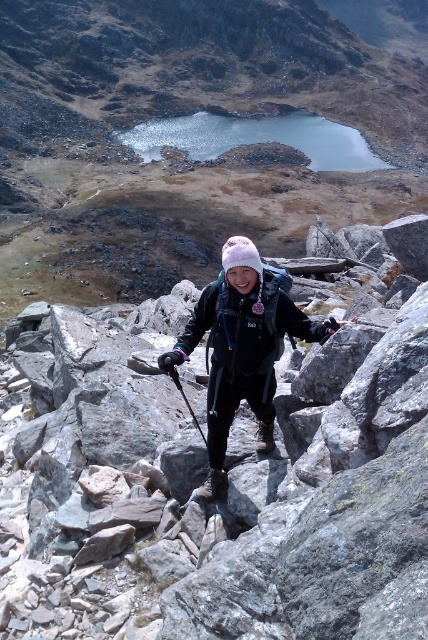
You are a hiker planning to place a small first aid kit on the ground near the matte black backpack at center. The first aid kit requires a flat surface. Based on the scene description, is the area around point (189, 148) suitable for placing the first aid kit?

The area around point (189, 148) has the matte black backpack at center. The scene describes the ground as uneven with small stones and patches of grass, so it may not provide a completely flat surface. Therefore, the area might not be suitable for placing the first aid kit which requires a flat surface.

You are a hiker planning to take a photo of the matte black jacket at center. The camera you have can only focus on objects within a 0.1 unit radius around the point specified by coordinates. If you aim at point (241, 349), will the camera focus on the matte black jacket at center?

Yes, because the point (241, 349) marks the matte black jacket at center, so the camera will focus on it.

You are a photographer planning to take a closeup shot of the matte black jacket at center and the black rubber ski pole at center. Which object should you zoom in on more to ensure both are equally visible in the frame?

The matte black jacket at center is larger in size than the black rubber ski pole at center, so you should zoom in slightly more on the black rubber ski pole at center to make both appear equally visible in the frame.